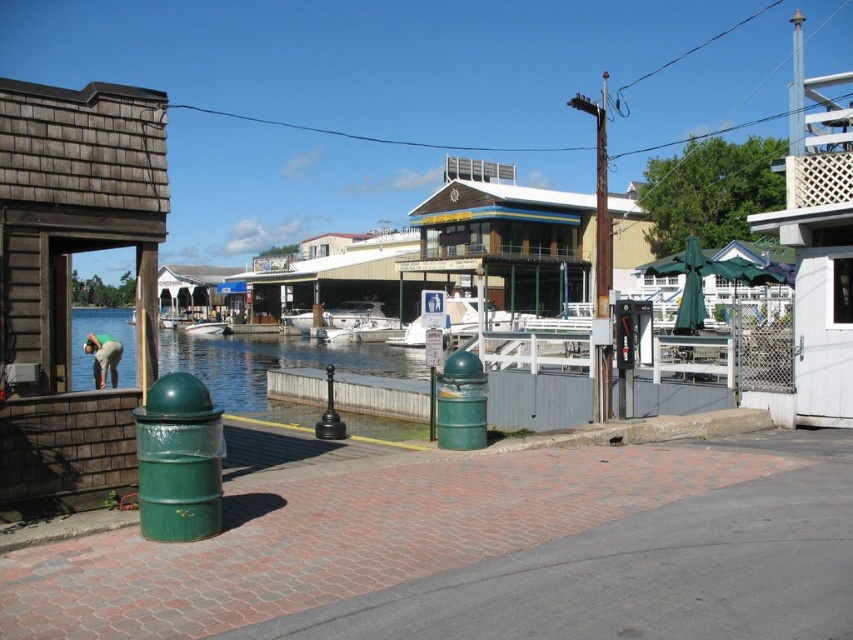
Does rusty metal pole at center-right appear under white glossy boat at center?

Incorrect, rusty metal pole at center-right is not positioned below white glossy boat at center.

Between point (607, 314) and point (218, 332), which one is positioned behind?

The point (218, 332) is behind.

Does point (596, 275) lie in front of point (223, 328)?

Yes, point (596, 275) is in front of point (223, 328).

Locate an element on the screen. This screenshot has width=853, height=640. rusty metal pole at center-right is located at coordinates (601, 202).